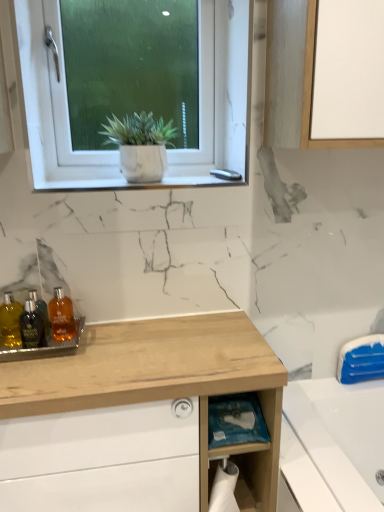
This screenshot has height=512, width=384. What are the coordinates of `vacant space to the right of translucent plastic bottles at lower left, which ranks as the second toiletry in left-to-right order` in the screenshot? It's located at (122, 344).